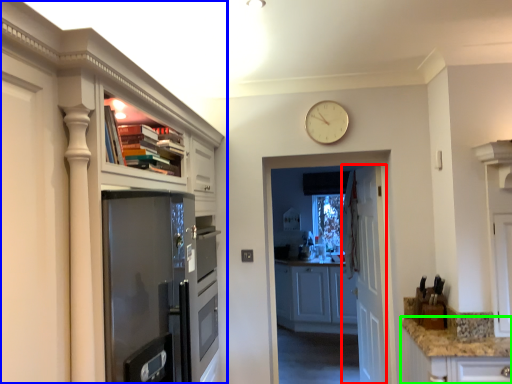
Question: Which object is positioned closest to door (highlighted by a red box)? Select from cabinetry (highlighted by a blue box) and counter top (highlighted by a green box).

Choices:
 (A) cabinetry
 (B) counter top

Answer: (B)